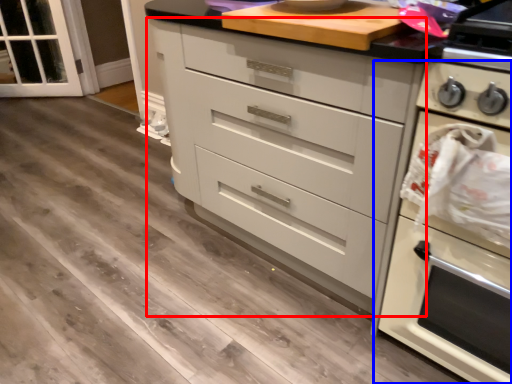
Question: Which point is further to the camera, chest of drawers (highlighted by a red box) or home appliance (highlighted by a blue box)?

Choices:
 (A) chest of drawers
 (B) home appliance

Answer: (A)